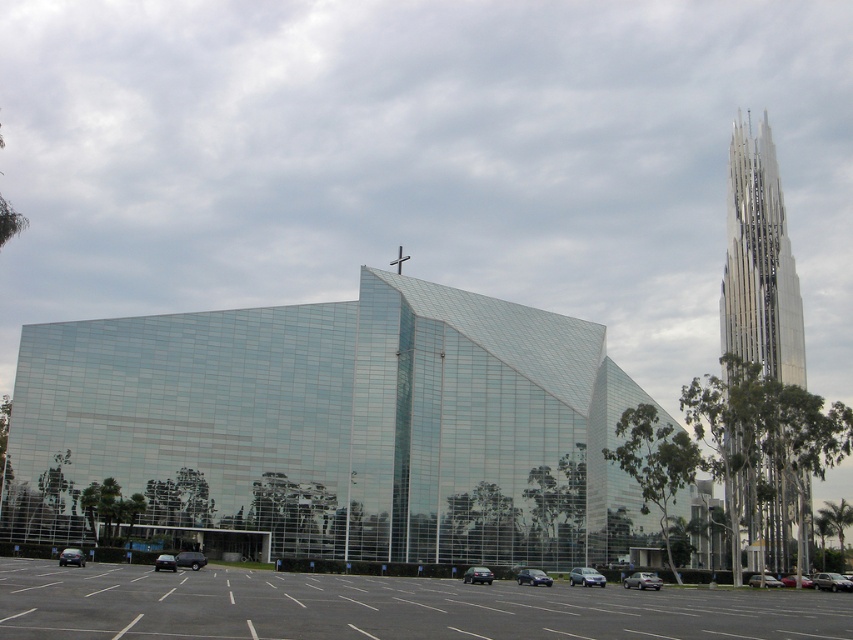
Question: Where is matte black car at center located in relation to metallic silver car at lower right in the image?

Choices:
 (A) left
 (B) right

Answer: (A)

Question: Does silver metallic sedan at center have a lesser width compared to shiny black sedan at center?

Choices:
 (A) no
 (B) yes

Answer: (A)

Question: Is gray asphalt parking lot at lower center below shiny black sedan at center?

Choices:
 (A) no
 (B) yes

Answer: (A)

Question: Among these objects, which one is farthest from the camera?

Choices:
 (A) silver metallic sedan at center
 (B) shiny black sedan at center

Answer: (A)

Question: Which point appears farthest from the camera in this image?

Choices:
 (A) (519, 572)
 (B) (157, 561)

Answer: (A)

Question: Which of the following is the farthest from the observer?

Choices:
 (A) (752, 577)
 (B) (476, 572)
 (C) (221, 620)

Answer: (A)